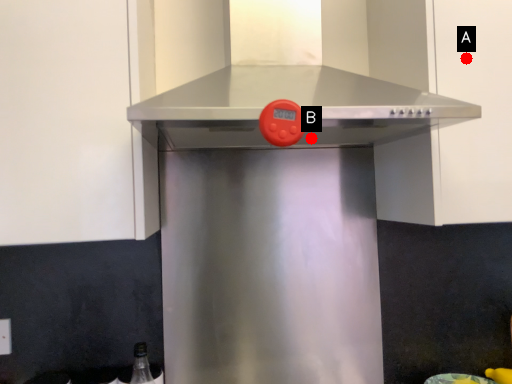
Question: Two points are circled on the image, labeled by A and B beside each circle. Which point appears closest to the camera in this image?

Choices:
 (A) A is closer
 (B) B is closer

Answer: (A)